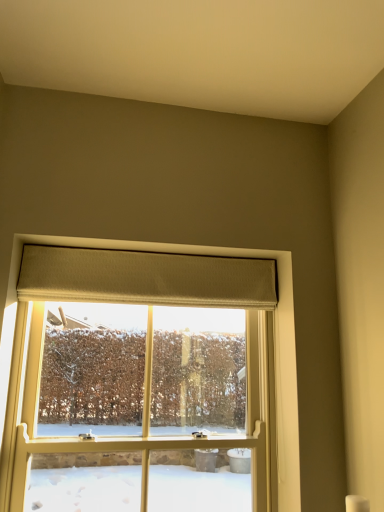
Question: Considering the positions of beige textured curtain at upper center and clear glass window at center in the image, is beige textured curtain at upper center bigger or smaller than clear glass window at center?

Choices:
 (A) small
 (B) big

Answer: (A)

Question: Relative to clear glass window at center, is beige textured curtain at upper center in front or behind?

Choices:
 (A) behind
 (B) front

Answer: (A)

Question: Does point (226, 263) appear closer or farther from the camera than point (49, 239)?

Choices:
 (A) farther
 (B) closer

Answer: (A)

Question: Is clear glass window at center wider or thinner than beige textured curtain at upper center?

Choices:
 (A) thin
 (B) wide

Answer: (B)

Question: From a real-world perspective, is clear glass window at center above or below beige textured curtain at upper center?

Choices:
 (A) below
 (B) above

Answer: (A)

Question: Considering the positions of point (240, 249) and point (218, 270), is point (240, 249) closer or farther from the camera than point (218, 270)?

Choices:
 (A) farther
 (B) closer

Answer: (B)

Question: In terms of height, does clear glass window at center look taller or shorter compared to beige textured curtain at upper center?

Choices:
 (A) tall
 (B) short

Answer: (A)